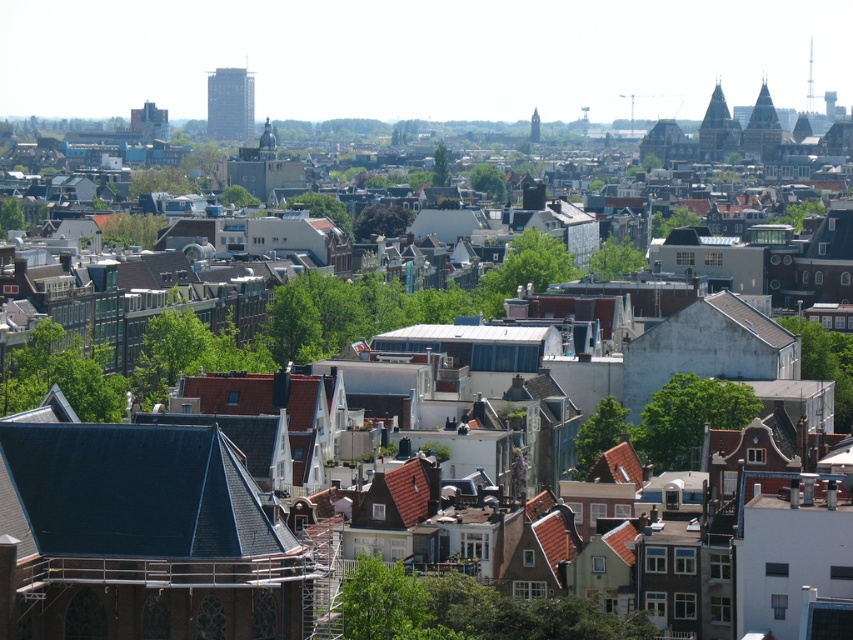
Does point (210, 116) lie in front of point (727, 129)?

No, it is not.

The width and height of the screenshot is (853, 640). What are the coordinates of `glassy modern skyscraper at upper center` in the screenshot? It's located at (230, 104).

Who is more forward, (222,108) or (717,104)?

Positioned in front is point (717,104).

You are a GUI agent. You are given a task and a screenshot of the screen. Output one action in this format:
    pyautogui.click(x=<x>, y=<y>)
    Task: Click on the glassy modern skyscraper at upper center
    The width and height of the screenshot is (853, 640).
    Given the screenshot: What is the action you would take?
    pyautogui.click(x=230, y=104)

Is glassy modern skyscraper at upper center below smooth silver spire at upper center?

Yes.

From the picture: Can you confirm if glassy modern skyscraper at upper center is thinner than smooth silver spire at upper center?

No.

Image resolution: width=853 pixels, height=640 pixels. What do you see at coordinates (230, 104) in the screenshot?
I see `glassy modern skyscraper at upper center` at bounding box center [230, 104].

Find the location of a particular element. The width and height of the screenshot is (853, 640). glassy modern skyscraper at upper center is located at coordinates (230, 104).

Does brown stone tower at upper right have a lesser width compared to smooth silver spire at upper center?

No.

How much distance is there between brown stone tower at upper right and smooth silver spire at upper center?

brown stone tower at upper right and smooth silver spire at upper center are 40.05 meters apart from each other.

This screenshot has height=640, width=853. In order to click on brown stone tower at upper right in this screenshot , I will do `click(717, 129)`.